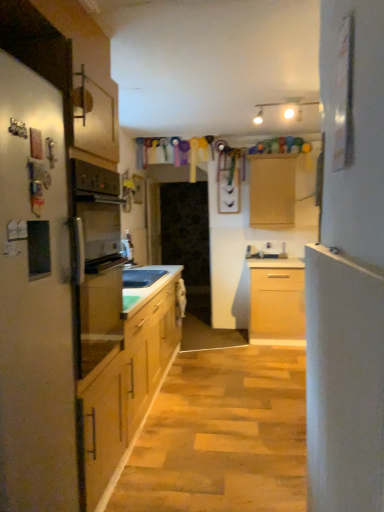
Question: Is white smooth door at right beside wooden cabinet at center?

Choices:
 (A) yes
 (B) no

Answer: (B)

Question: From a real-world perspective, is white smooth door at right located higher than wooden cabinet at center?

Choices:
 (A) no
 (B) yes

Answer: (A)

Question: Would you say wooden cabinet at center is part of white smooth door at right's contents?

Choices:
 (A) yes
 (B) no

Answer: (B)

Question: Does white smooth door at right have a smaller size compared to wooden cabinet at center?

Choices:
 (A) yes
 (B) no

Answer: (A)

Question: Does white smooth door at right have a lesser width compared to wooden cabinet at center?

Choices:
 (A) no
 (B) yes

Answer: (A)

Question: From the image's perspective, is white smooth door at right located above wooden cabinet at center?

Choices:
 (A) yes
 (B) no

Answer: (B)

Question: From the image's perspective, is wooden cabinet at center located beneath white smooth door at right?

Choices:
 (A) yes
 (B) no

Answer: (B)

Question: Is wooden cabinet at center to the right of white smooth door at right from the viewer's perspective?

Choices:
 (A) no
 (B) yes

Answer: (B)

Question: Can you confirm if wooden cabinet at center is thinner than white smooth door at right?

Choices:
 (A) yes
 (B) no

Answer: (A)

Question: From a real-world perspective, is wooden cabinet at center on white smooth door at right?

Choices:
 (A) yes
 (B) no

Answer: (A)

Question: Is the position of wooden cabinet at center more distant than that of white smooth door at right?

Choices:
 (A) yes
 (B) no

Answer: (A)

Question: Is wooden cabinet at center placed right next to white smooth door at right?

Choices:
 (A) yes
 (B) no

Answer: (B)

Question: Does matte white refrigerator at left have a lesser width compared to wooden cabinet at center?

Choices:
 (A) no
 (B) yes

Answer: (A)